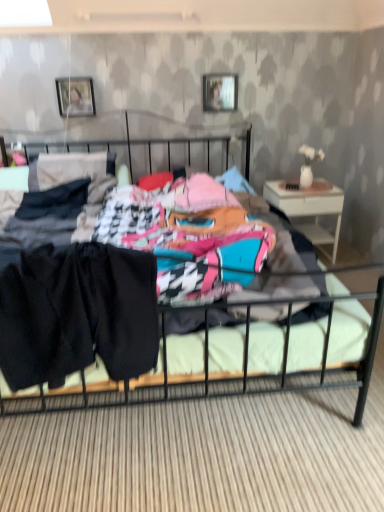
This screenshot has height=512, width=384. Describe the element at coordinates (309, 209) in the screenshot. I see `white wood nightstand at right` at that location.

Describe the element at coordinates (75, 96) in the screenshot. I see `matte silver picture frame at upper center, the 2th picture frame viewed from the right` at that location.

Where is `black fabric shorts at center`? Image resolution: width=384 pixels, height=512 pixels. black fabric shorts at center is located at coordinates (77, 314).

Identify the location of white wood nightstand at right. This screenshot has height=512, width=384. pyautogui.click(x=309, y=209).

Is black fabric bed at center next to black fabric shorts at center and touching it?

black fabric bed at center and black fabric shorts at center are not in contact.

Which is correct: black fabric bed at center is inside black fabric shorts at center, or outside of it?

black fabric bed at center cannot be found inside black fabric shorts at center.

Can you confirm if black fabric bed at center is shorter than black fabric shorts at center?

No, black fabric bed at center is not shorter than black fabric shorts at center.

Consider the image. From the image's perspective, which one is positioned lower, black fabric bed at center or matte silver picture frame at upper center, the 2th picture frame viewed from the right?

black fabric bed at center is shown below in the image.

How far apart are black fabric bed at center and matte silver picture frame at upper center, positioned as the first picture frame in left-to-right order?

black fabric bed at center is 7.18 feet from matte silver picture frame at upper center, positioned as the first picture frame in left-to-right order.

From a real-world perspective, relative to matte silver picture frame at upper center, positioned as the first picture frame in left-to-right order, is black fabric bed at center vertically above or below?

In terms of real-world spatial position, black fabric bed at center is below matte silver picture frame at upper center, positioned as the first picture frame in left-to-right order.

Can you confirm if black fabric bed at center is wider than matte silver picture frame at upper center, the 2th picture frame viewed from the right?

Indeed, black fabric bed at center has a greater width compared to matte silver picture frame at upper center, the 2th picture frame viewed from the right.

Which is in front, metallic silver picture frame at upper center, the 1th picture frame from the right, or white wood nightstand at right?

white wood nightstand at right is closer to the camera.

Is metallic silver picture frame at upper center, which is the 2th picture frame from left to right, outside of white wood nightstand at right?

Indeed, metallic silver picture frame at upper center, which is the 2th picture frame from left to right, is completely outside white wood nightstand at right.

Based on the photo, which is farther, (218,103) or (320,204)?

The point (218,103) is farther.

Is point (175, 142) less distant than point (211, 83)?

No, (175, 142) is further to viewer.

From the image's perspective, would you say black fabric bed at center is positioned over metallic silver picture frame at upper center, the 1th picture frame from the right?

No.

Who is shorter, matte silver picture frame at upper center, positioned as the first picture frame in left-to-right order, or white wood nightstand at right?

With less height is matte silver picture frame at upper center, positioned as the first picture frame in left-to-right order.

From the white wood nightstand at right, count 1st picture frames backward and point to it. Please provide its 2D coordinates.

[(75, 96)]

Could white wood nightstand at right be considered to be inside matte silver picture frame at upper center, the 2th picture frame viewed from the right?

That's incorrect, white wood nightstand at right is not inside matte silver picture frame at upper center, the 2th picture frame viewed from the right.

Can we say black fabric shorts at center lies outside matte silver picture frame at upper center, positioned as the first picture frame in left-to-right order?

That's correct, black fabric shorts at center is outside of matte silver picture frame at upper center, positioned as the first picture frame in left-to-right order.

Based on the photo, from a real-world perspective, is black fabric shorts at center above or below matte silver picture frame at upper center, the 2th picture frame viewed from the right?

Clearly, from a real-world perspective, black fabric shorts at center is below matte silver picture frame at upper center, the 2th picture frame viewed from the right.

Based on their sizes in the image, would you say black fabric shorts at center is bigger or smaller than matte silver picture frame at upper center, the 2th picture frame viewed from the right?

black fabric shorts at center is bigger than matte silver picture frame at upper center, the 2th picture frame viewed from the right.

Which object is thinner, black fabric shorts at center or matte silver picture frame at upper center, the 2th picture frame viewed from the right?

Thinner between the two is matte silver picture frame at upper center, the 2th picture frame viewed from the right.

From the image's perspective, count 2nd picture frames upward from the black fabric bed at center and point to it. Please provide its 2D coordinates.

[(220, 92)]

Is metallic silver picture frame at upper center, the 1th picture frame from the right, oriented towards black fabric bed at center?

No, metallic silver picture frame at upper center, the 1th picture frame from the right, is not oriented towards black fabric bed at center.

How far apart are metallic silver picture frame at upper center, which is the 2th picture frame from left to right, and black fabric bed at center?

metallic silver picture frame at upper center, which is the 2th picture frame from left to right, and black fabric bed at center are 2.00 meters apart from each other.

Would you say metallic silver picture frame at upper center, which is the 2th picture frame from left to right, is to the left or to the right of black fabric bed at center in the picture?

metallic silver picture frame at upper center, which is the 2th picture frame from left to right, is to the right of black fabric bed at center.

The image size is (384, 512). In order to click on bed on the right of black fabric shorts at center in this screenshot , I will do `click(321, 345)`.

The image size is (384, 512). I want to click on bed below the matte silver picture frame at upper center, the 2th picture frame viewed from the right (from the image's perspective), so pyautogui.click(x=321, y=345).

Consider the image. Looking at the image, which one is located further to black fabric bed at center, metallic silver picture frame at upper center, the 1th picture frame from the right, or black fabric shorts at center?

A: Among the two, metallic silver picture frame at upper center, the 1th picture frame from the right, is located further to black fabric bed at center.

Considering their positions, is black fabric bed at center positioned closer to matte silver picture frame at upper center, the 2th picture frame viewed from the right, than black fabric shorts at center?

black fabric bed at center is positioned closer to the anchor matte silver picture frame at upper center, the 2th picture frame viewed from the right.

Based on their spatial positions, is metallic silver picture frame at upper center, which is the 2th picture frame from left to right, or black fabric bed at center further from black fabric shorts at center?

metallic silver picture frame at upper center, which is the 2th picture frame from left to right, lies further to black fabric shorts at center than the other object.

Considering their positions, is metallic silver picture frame at upper center, the 1th picture frame from the right, positioned closer to white wood nightstand at right than black fabric bed at center?

metallic silver picture frame at upper center, the 1th picture frame from the right.

From the image, which object appears to be nearer to white wood nightstand at right, black fabric shorts at center or matte silver picture frame at upper center, the 2th picture frame viewed from the right?

matte silver picture frame at upper center, the 2th picture frame viewed from the right, lies closer to white wood nightstand at right than the other object.

When comparing their distances from matte silver picture frame at upper center, the 2th picture frame viewed from the right, does metallic silver picture frame at upper center, which is the 2th picture frame from left to right, or white wood nightstand at right seem further?

Among the two, white wood nightstand at right is located further to matte silver picture frame at upper center, the 2th picture frame viewed from the right.

Estimate the real-world distances between objects in this image. Which object is further from matte silver picture frame at upper center, the 2th picture frame viewed from the right, black fabric shorts at center or white wood nightstand at right?

black fabric shorts at center.

From the image, which object appears to be farther from white wood nightstand at right, black fabric shorts at center or black fabric bed at center?

black fabric shorts at center lies further to white wood nightstand at right than the other object.

Where is `nightstand located between black fabric shorts at center and matte silver picture frame at upper center, positioned as the first picture frame in left-to-right order, in the depth direction`? This screenshot has height=512, width=384. nightstand located between black fabric shorts at center and matte silver picture frame at upper center, positioned as the first picture frame in left-to-right order, in the depth direction is located at coordinates (309, 209).

I want to click on clothing between black fabric bed at center and metallic silver picture frame at upper center, which is the 2th picture frame from left to right, in the front-back direction, so click(x=77, y=314).

Where is `clothing between black fabric bed at center and white wood nightstand at right from front to back`? The height and width of the screenshot is (512, 384). clothing between black fabric bed at center and white wood nightstand at right from front to back is located at coordinates (77, 314).

At what (x,y) coordinates should I click in order to perform the action: click on picture frame situated between matte silver picture frame at upper center, positioned as the first picture frame in left-to-right order, and white wood nightstand at right from left to right. Please return your answer as a coordinate pair (x, y). Looking at the image, I should click on (220, 92).